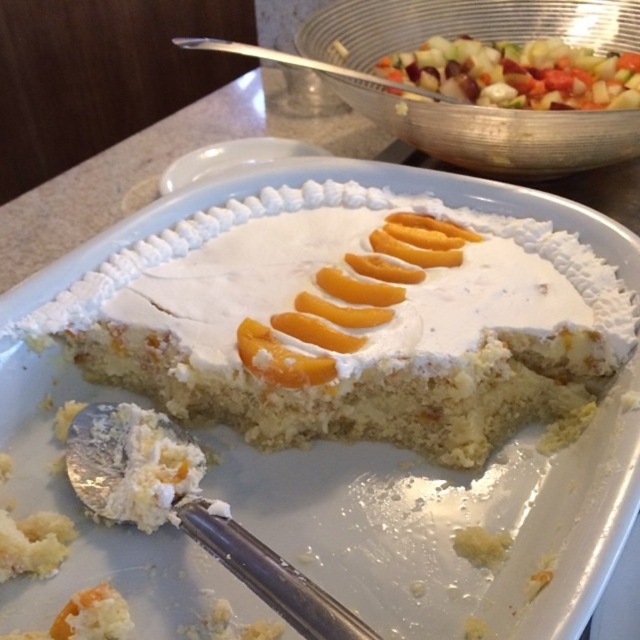
You are standing at point A, which is located at point (321, 266). You want to move to point B, which is 3.60 feet away from you. Is there enough space for you to move freely between these two points?

They are 3.60 feet apart, so yes, there is enough space to move freely between these two points.

You are a guest at a birthday party and want to take a photo of the white creamy cake at center and the white creamy frosting at center. Which one will appear taller in the photo?

The white creamy cake at center will appear taller in the photo because it has a greater height compared to the white creamy frosting at center.